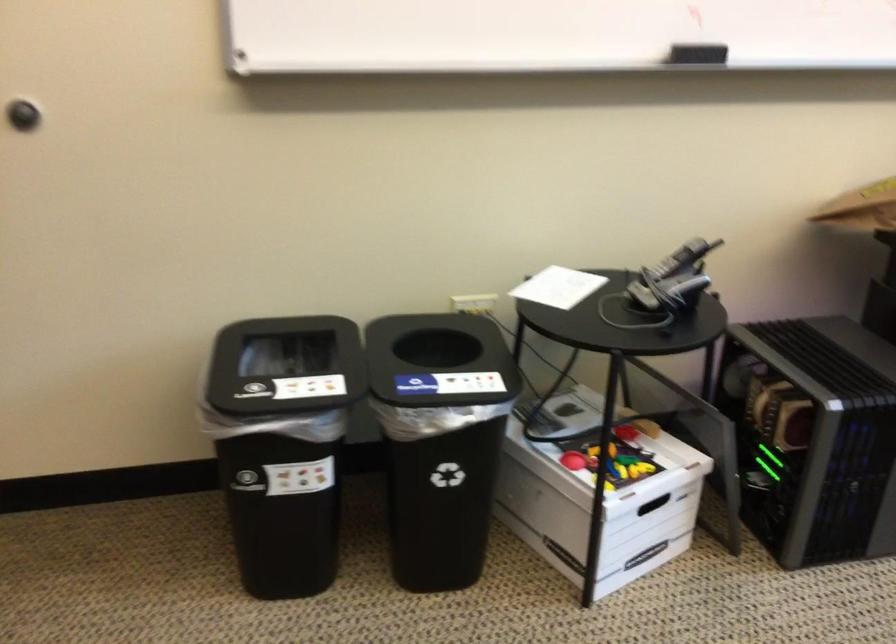
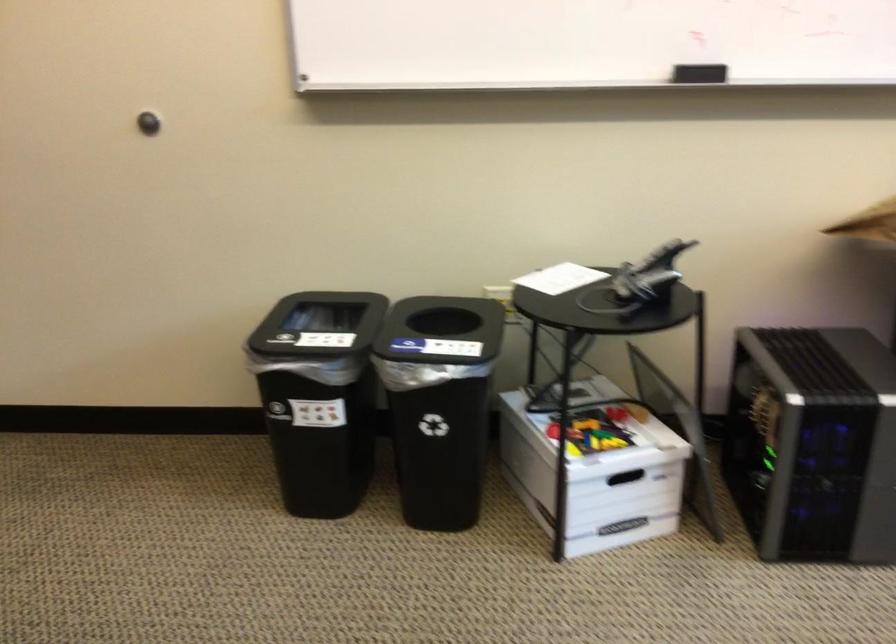
Where in the second image is the point corresponding to the point at 286,366 from the first image?

(336, 330)